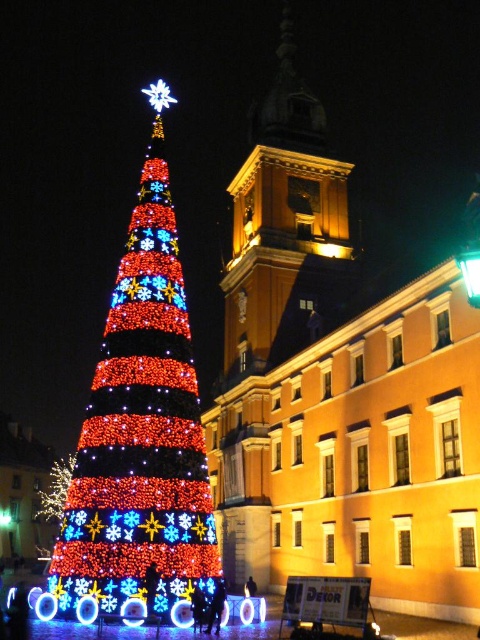
Question: Which point is closer to the camera taking this photo?

Choices:
 (A) (67, 465)
 (B) (183, 387)

Answer: (B)

Question: Which point appears closest to the camera in this image?

Choices:
 (A) (140, 353)
 (B) (74, 456)
 (C) (253, 138)

Answer: (A)

Question: Which point is farther to the camera?

Choices:
 (A) (68, 484)
 (B) (262, 305)
 (C) (96, 388)

Answer: (A)

Question: Does illuminated fabric christmas tree at left have a larger size compared to golden stone bell tower at upper center?

Choices:
 (A) yes
 (B) no

Answer: (B)

Question: Can you confirm if illuminated fabric christmas tree at left is bigger than golden stone bell tower at upper center?

Choices:
 (A) no
 (B) yes

Answer: (A)

Question: Does illuminated fabric christmas tree at left have a smaller size compared to golden stone bell tower at upper center?

Choices:
 (A) no
 (B) yes

Answer: (B)